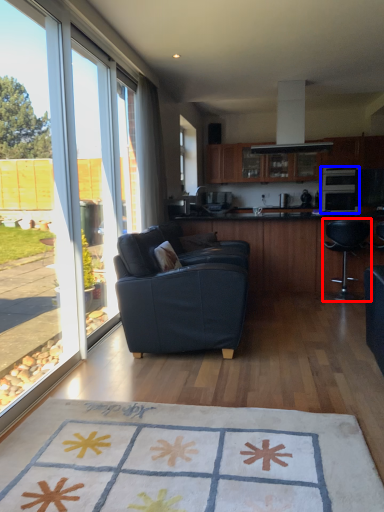
Question: Which of the following is the closest to the observer, chair (highlighted by a red box) or appliance (highlighted by a blue box)?

Choices:
 (A) chair
 (B) appliance

Answer: (A)